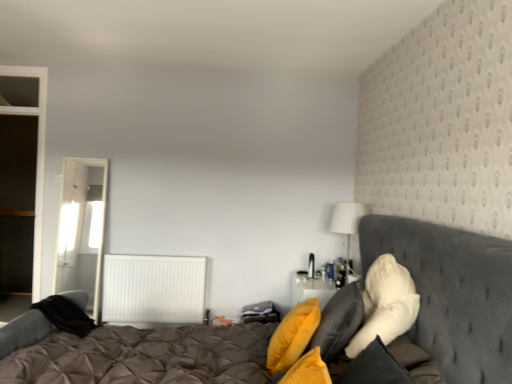
Question: Does yellow fabric pillow at center, the third pillow when ordered from right to left, have a greater height compared to white fabric lampshade at upper right?

Choices:
 (A) no
 (B) yes

Answer: (A)

Question: Does yellow fabric pillow at center, the third pillow when ordered from right to left, appear on the right side of white fabric lampshade at upper right?

Choices:
 (A) yes
 (B) no

Answer: (B)

Question: Is yellow fabric pillow at center, the third pillow when ordered from right to left, next to white fabric lampshade at upper right?

Choices:
 (A) yes
 (B) no

Answer: (B)

Question: Is yellow fabric pillow at center, the third pillow when ordered from right to left, not inside white fabric lampshade at upper right?

Choices:
 (A) yes
 (B) no

Answer: (A)

Question: From the image's perspective, is yellow fabric pillow at center, acting as the first pillow starting from the left, over white fabric lampshade at upper right?

Choices:
 (A) no
 (B) yes

Answer: (A)

Question: From a real-world perspective, is yellow fabric pillow at center, acting as the first pillow starting from the left, physically above white fabric lampshade at upper right?

Choices:
 (A) no
 (B) yes

Answer: (A)

Question: Is white fabric lampshade at upper right aimed at yellow fabric pillow at center, the third pillow when ordered from right to left?

Choices:
 (A) no
 (B) yes

Answer: (A)

Question: Is white fabric lampshade at upper right not close to yellow fabric pillow at center, the third pillow when ordered from right to left?

Choices:
 (A) no
 (B) yes

Answer: (B)

Question: Does white fabric lampshade at upper right come behind yellow fabric pillow at center, the third pillow when ordered from right to left?

Choices:
 (A) no
 (B) yes

Answer: (B)

Question: Is the depth of white fabric lampshade at upper right less than that of yellow fabric pillow at center, the third pillow when ordered from right to left?

Choices:
 (A) yes
 (B) no

Answer: (B)

Question: From the image's perspective, does white fabric lampshade at upper right appear lower than yellow fabric pillow at center, the third pillow when ordered from right to left?

Choices:
 (A) no
 (B) yes

Answer: (A)

Question: Can yellow fabric pillow at center, the third pillow when ordered from right to left, be found inside white fabric lampshade at upper right?

Choices:
 (A) no
 (B) yes

Answer: (A)

Question: From the image's perspective, would you say white fabric lampshade at upper right is positioned over white fluffy pillow at right, the 3th pillow positioned from the left?

Choices:
 (A) no
 (B) yes

Answer: (B)